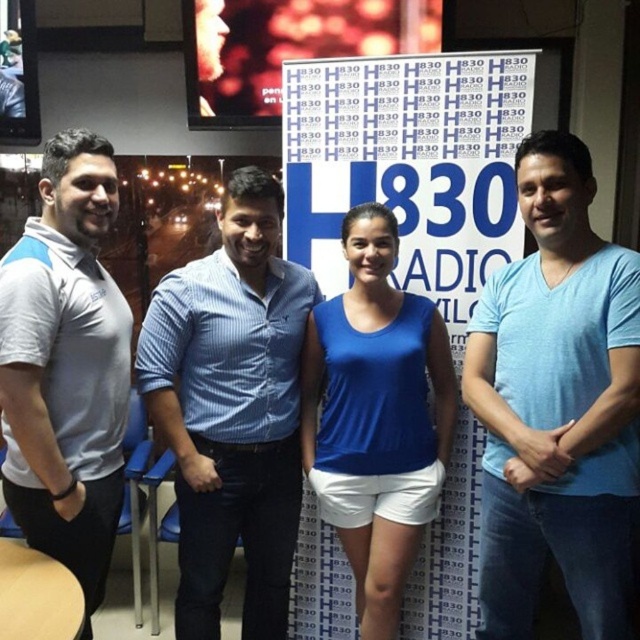
You are standing in the room where the photo was taken and want to find the blue fabric sign at center. Based on the coordinates provided, which direction should you look to locate it?

The blue fabric sign at center is located at coordinates point (408, 164), so you should look to the center of the room to find it.

You are a photographer trying to adjust the lighting for a group photo. You notice two people in the scene wearing the gray fabric polo shirt at left and the blue fabric tank top at center. Which person should you focus the light on to ensure their clothing stands out more, considering their shirt sizes?

The gray fabric polo shirt at left is larger in size than the blue fabric tank top at center, so focusing the light on the gray fabric polo shirt at left would make its clothing stand out more due to its larger surface area.

You are a photographer trying to capture a clear shot of the blue fabric sign at center and the blue striped shirt at center. Which object should you focus on first if you want to ensure both are in focus, considering their sizes?

The blue fabric sign at center is bigger than the blue striped shirt at center, so focusing on the larger blue fabric sign at center first will help ensure both are in focus.